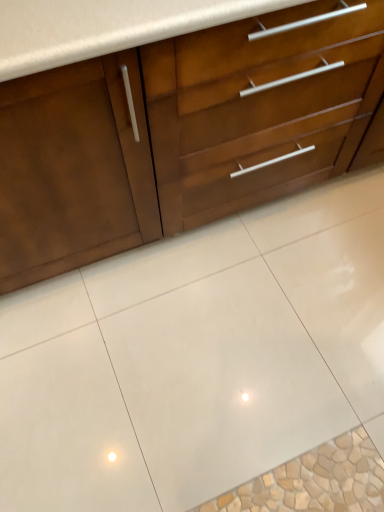
You are a GUI agent. You are given a task and a screenshot of the screen. Output one action in this format:
    pyautogui.click(x=<x>, y=<y>)
    Task: Click on the free space above white glossy tile at center (from a real-world perspective)
    
    Given the screenshot: What is the action you would take?
    pyautogui.click(x=238, y=340)